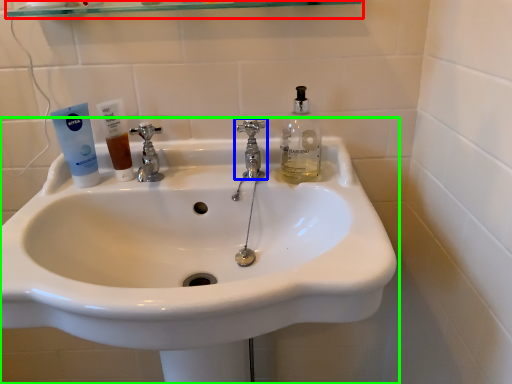
Question: Which object is the farthest from shelf (highlighted by a red box)? Choose among these: tap (highlighted by a blue box) or sink (highlighted by a green box).

Choices:
 (A) tap
 (B) sink

Answer: (B)